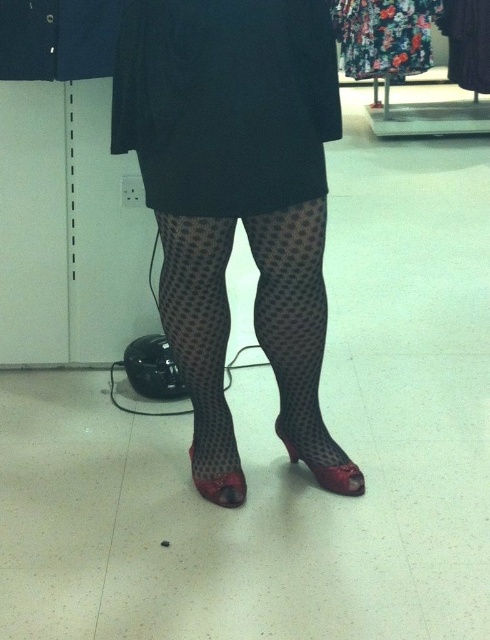
Describe the element at coordinates (238, 196) in the screenshot. The height and width of the screenshot is (640, 490). I see `transparent net tights at center` at that location.

Can you confirm if transparent net tights at center is bigger than matte red high-heeled shoe at lower center?

Yes, transparent net tights at center is bigger than matte red high-heeled shoe at lower center.

Is point (163, 177) positioned in front of point (320, 480)?

Yes, point (163, 177) is in front of point (320, 480).

Find the location of `transparent net tights at center`. transparent net tights at center is located at coordinates (238, 196).

Is point (251, 208) positioned behind point (325, 461)?

That is False.

Which is in front, point (300, 186) or point (301, 413)?

Positioned in front is point (300, 186).

Who is more forward, (314, 56) or (280, 401)?

Positioned in front is point (314, 56).

Locate an element on the screen. The image size is (490, 640). black mesh dress at center is located at coordinates (225, 102).

Does transparent net tights at center have a lesser width compared to floral fabric dress at upper center?

Yes.

Where is `transparent net tights at center`? Image resolution: width=490 pixels, height=640 pixels. transparent net tights at center is located at coordinates (238, 196).

Find the location of a particular element. This screenshot has width=490, height=640. transparent net tights at center is located at coordinates (238, 196).